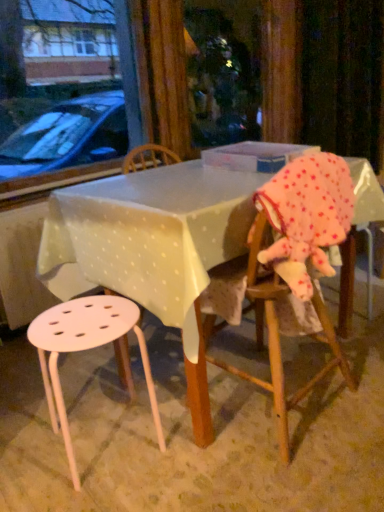
This screenshot has width=384, height=512. I want to click on translucent plastic box at center, so click(255, 156).

In order to face white plastic table at center, should I rotate leftwards or rightwards?

A 3.500 degree turn to the right will do.

At what (x,y) coordinates should I click in order to perform the action: click on wooden chair at right. Please return your answer as a coordinate pair (x, y). The image size is (384, 512). Looking at the image, I should click on (269, 320).

Where is `translucent plastic box at center`? translucent plastic box at center is located at coordinates (255, 156).

Would you say white plastic table at center is to the left or to the right of white plastic stool at lower left in the picture?

white plastic table at center is positioned on white plastic stool at lower left's right side.

At what (x,y) coordinates should I click in order to perform the action: click on stool below the white plastic table at center (from the image's perspective). Please return your answer as a coordinate pair (x, y). The width and height of the screenshot is (384, 512). Looking at the image, I should click on (84, 350).

Is white plastic stool at lower left at the left side of pink polka dot fabric at right?

Indeed, white plastic stool at lower left is positioned on the left side of pink polka dot fabric at right.

From the image's perspective, relative to pink polka dot fabric at right, is white plastic stool at lower left above or below?

From the image's perspective, white plastic stool at lower left appears below pink polka dot fabric at right.

Is point (97, 334) positioned before point (323, 168)?

No, (97, 334) is behind (323, 168).

Is white plastic stool at lower left bigger or smaller than pink polka dot fabric at right?

Clearly, white plastic stool at lower left is larger in size than pink polka dot fabric at right.

Consider the image. Is translucent plastic box at center far away from pink polka dot fabric at right?

No, translucent plastic box at center is not far from pink polka dot fabric at right.

Is translucent plastic box at center in front of pink polka dot fabric at right?

No, translucent plastic box at center is further to the viewer.

Does translucent plastic box at center turn towards pink polka dot fabric at right?

No, translucent plastic box at center does not turn towards pink polka dot fabric at right.

From a real-world perspective, which is physically above, white plastic stool at lower left or wooden chair at right?

In real-world perspective, wooden chair at right is above.

Based on the photo, can you tell me how much white plastic stool at lower left and wooden chair at right differ in facing direction?

The angular difference between white plastic stool at lower left and wooden chair at right is 9.15 degrees.

Which object is positioned more to the right, white plastic stool at lower left or wooden chair at right?

Positioned to the right is wooden chair at right.

From the image's perspective, is white plastic stool at lower left located above wooden chair at right?

No, from the image's perspective, white plastic stool at lower left is not above wooden chair at right.

Are wooden chair at right and translucent plastic box at center far apart?

No, wooden chair at right is not far away from translucent plastic box at center.

From the image's perspective, relative to translucent plastic box at center, is wooden chair at right above or below?

Based on their image positions, wooden chair at right is located beneath translucent plastic box at center.

Is wooden chair at right shorter than translucent plastic box at center?

No.

From a real-world perspective, which is physically below, wooden chair at right or translucent plastic box at center?

In real-world perspective, wooden chair at right is lower.

Looking at this image, is translucent plastic box at center located outside wooden chair at right?

translucent plastic box at center lies outside wooden chair at right's area.

Can you confirm if translucent plastic box at center is shorter than wooden chair at right?

Correct, translucent plastic box at center is not as tall as wooden chair at right.

Is translucent plastic box at center in contact with wooden chair at right?

No, translucent plastic box at center is not next to wooden chair at right.

Is white plastic stool at lower left oriented towards white plastic table at center?

No, white plastic stool at lower left is not oriented towards white plastic table at center.

From a real-world perspective, relative to white plastic table at center, is white plastic stool at lower left vertically above or below?

From a real-world perspective, white plastic stool at lower left is physically below white plastic table at center.

Is white plastic stool at lower left thinner than white plastic table at center?

Indeed, white plastic stool at lower left has a lesser width compared to white plastic table at center.

How different are the orientations of white plastic stool at lower left and white plastic table at center in degrees?

9.15 degrees separate the facing orientations of white plastic stool at lower left and white plastic table at center.

The width and height of the screenshot is (384, 512). What are the coordinates of `stool that appears on the left of white plastic table at center` in the screenshot? It's located at pyautogui.click(x=84, y=350).

Locate an element on the screen. The width and height of the screenshot is (384, 512). toddler on the right of white plastic stool at lower left is located at coordinates (306, 216).

Looking at the image, which one is located closer to wooden chair at right, white plastic table at center or translucent plastic box at center?

white plastic table at center.

Based on their spatial positions, is wooden chair at right or pink polka dot fabric at right closer to translucent plastic box at center?

pink polka dot fabric at right is closer to translucent plastic box at center.

Based on their spatial positions, is translucent plastic box at center or wooden chair at right further from white plastic table at center?

The object further to white plastic table at center is translucent plastic box at center.

In the scene shown: Based on their spatial positions, is wooden chair at right or translucent plastic box at center closer to white plastic stool at lower left?

Among the two, wooden chair at right is located nearer to white plastic stool at lower left.

Which object lies nearer to the anchor point white plastic table at center, translucent plastic box at center or white plastic stool at lower left?

white plastic stool at lower left is positioned closer to the anchor white plastic table at center.

Based on the photo, which object lies further to the anchor point white plastic stool at lower left, wooden chair at right or white plastic table at center?

Among the two, wooden chair at right is located further to white plastic stool at lower left.

Consider the image. From the image, which object appears to be farther from pink polka dot fabric at right, white plastic stool at lower left or translucent plastic box at center?

white plastic stool at lower left.

Which object lies nearer to the anchor point white plastic stool at lower left, white plastic table at center or pink polka dot fabric at right?

white plastic table at center is closer to white plastic stool at lower left.

At what (x,y) coordinates should I click in order to perform the action: click on toddler between white plastic table at center and translucent plastic box at center from front to back. Please return your answer as a coordinate pair (x, y). Image resolution: width=384 pixels, height=512 pixels. Looking at the image, I should click on (306, 216).

This screenshot has height=512, width=384. I want to click on chair situated between white plastic stool at lower left and pink polka dot fabric at right from left to right, so click(x=269, y=320).

The height and width of the screenshot is (512, 384). In order to click on chair located between white plastic table at center and pink polka dot fabric at right in the left-right direction in this screenshot , I will do `click(269, 320)`.

You are a GUI agent. You are given a task and a screenshot of the screen. Output one action in this format:
    pyautogui.click(x=<x>, y=<y>)
    Task: Click on the table between white plastic stool at lower left and wooden chair at right
    The height and width of the screenshot is (512, 384).
    Given the screenshot: What is the action you would take?
    pyautogui.click(x=152, y=248)